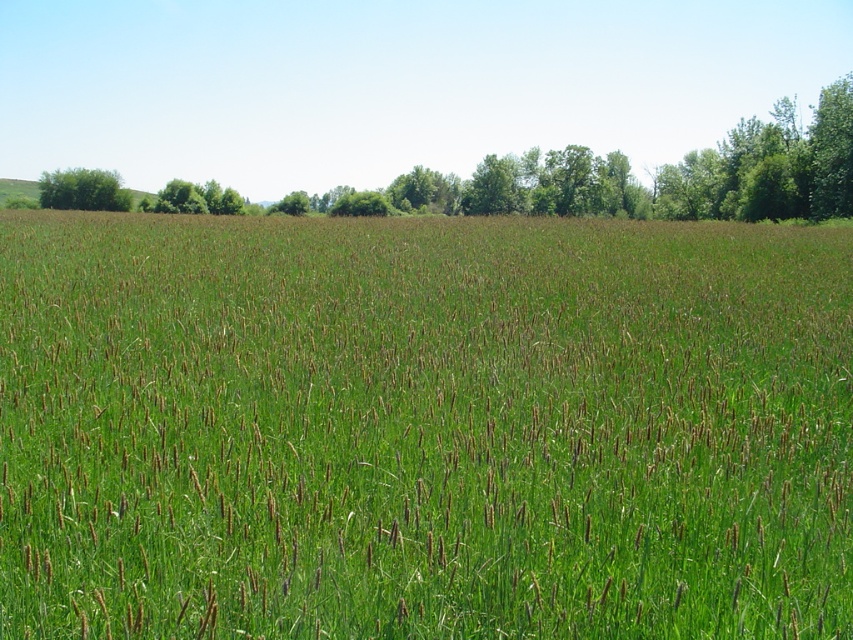
Can you confirm if green grassy field at center is thinner than green leafy tree at upper left?

Incorrect, green grassy field at center's width is not less than green leafy tree at upper left's.

Does green grassy field at center have a greater width compared to green leafy tree at upper left?

Yes, green grassy field at center is wider than green leafy tree at upper left.

Locate an element on the screen. green grassy field at center is located at coordinates (422, 428).